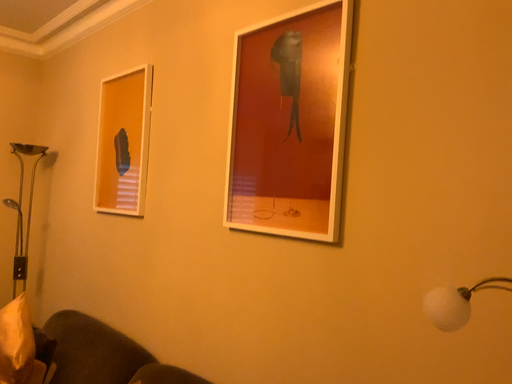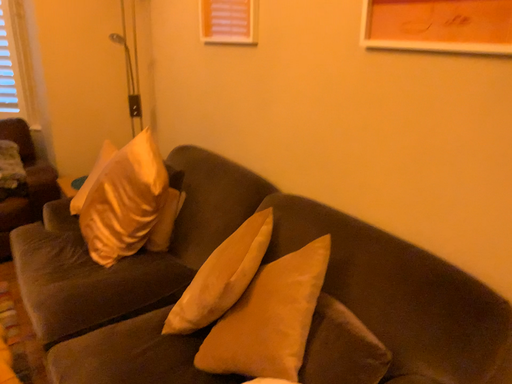
Question: Which way did the camera rotate in the video?

Choices:
 (A) rotated upward
 (B) rotated downward

Answer: (B)